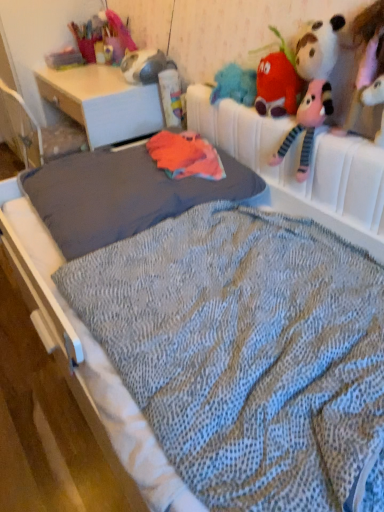
Question: Considering the relative positions of knitted plush strawberry at upper right, marked as the second toy in a right-to-left arrangement, and white plush toy at upper right, positioned as the 1th toy in right-to-left order, in the image provided, is knitted plush strawberry at upper right, marked as the second toy in a right-to-left arrangement, to the left or to the right of white plush toy at upper right, positioned as the 1th toy in right-to-left order,?

Choices:
 (A) left
 (B) right

Answer: (A)

Question: Do you think knitted plush strawberry at upper right, the first toy when ordered from left to right, is within white plush toy at upper right, which is the 2th toy in back-to-front order, or outside of it?

Choices:
 (A) outside
 (B) inside

Answer: (A)

Question: Estimate the real-world distances between objects in this image. Which object is farther from the gray fabric mattress at center?

Choices:
 (A) matte white desk at center
 (B) knitted plush strawberry at upper right, the first toy when ordered from left to right
 (C) white plush toy at upper right, which is the 2th toy in back-to-front order

Answer: (C)

Question: Which object is positioned closest to the matte white desk at center?

Choices:
 (A) knitted plush strawberry at upper right, which appears as the 2th toy when viewed from the front
 (B) gray fabric mattress at center
 (C) white plush toy at upper right, positioned as the 1th toy in right-to-left order

Answer: (B)